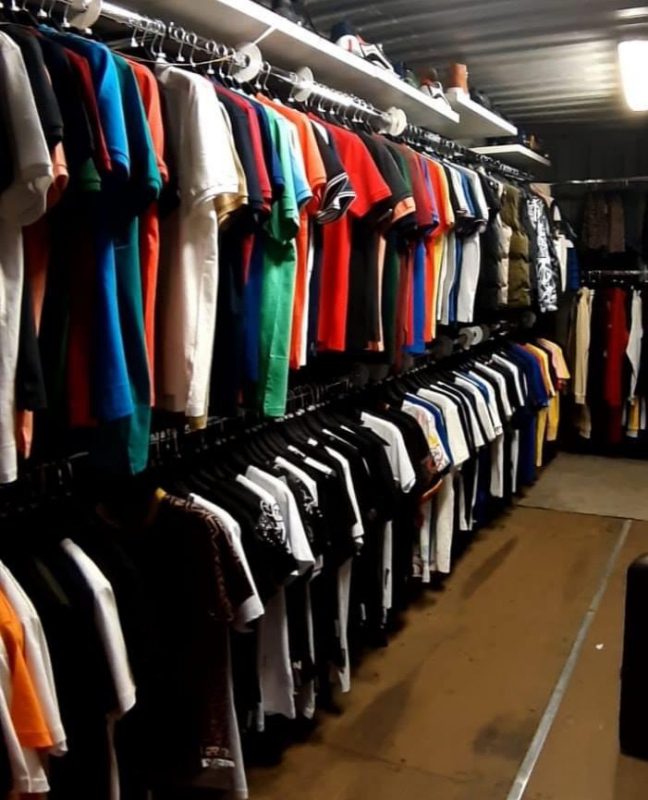
Where is `floor`? This screenshot has height=800, width=648. floor is located at coordinates (501, 658), (588, 717).